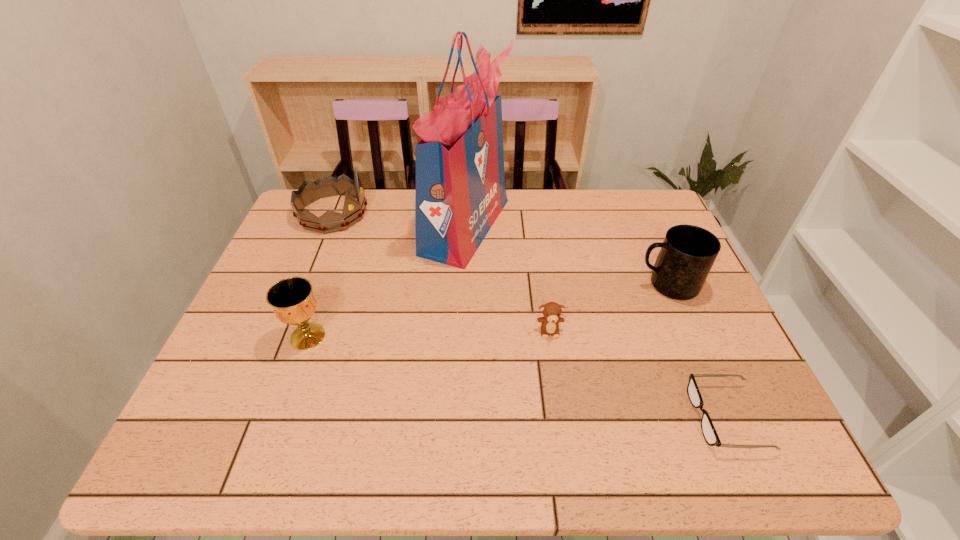
Locate an element on the screen. This screenshot has width=960, height=540. tiara present at the far edge is located at coordinates [x=325, y=186].

I want to click on object that is at the near edge, so click(710, 435).

This screenshot has height=540, width=960. What are the coordinates of `tiara situated at the left edge` in the screenshot? It's located at (325, 186).

The width and height of the screenshot is (960, 540). In order to click on chalice that is at the left edge in this screenshot , I will do `click(292, 300)`.

I want to click on mug that is at the right edge, so click(688, 252).

Where is `spectacles positioned at the right edge`? The height and width of the screenshot is (540, 960). spectacles positioned at the right edge is located at coordinates (710, 435).

The width and height of the screenshot is (960, 540). In order to click on object that is positioned at the far left corner in this screenshot , I will do `click(325, 186)`.

Find the location of a particular element. The image size is (960, 540). object present at the near right corner is located at coordinates (710, 435).

Locate an element on the screen. The image size is (960, 540). vacant space at the far edge of the desktop is located at coordinates (576, 209).

The width and height of the screenshot is (960, 540). In order to click on vacant region at the near edge of the desktop in this screenshot , I will do `click(610, 450)`.